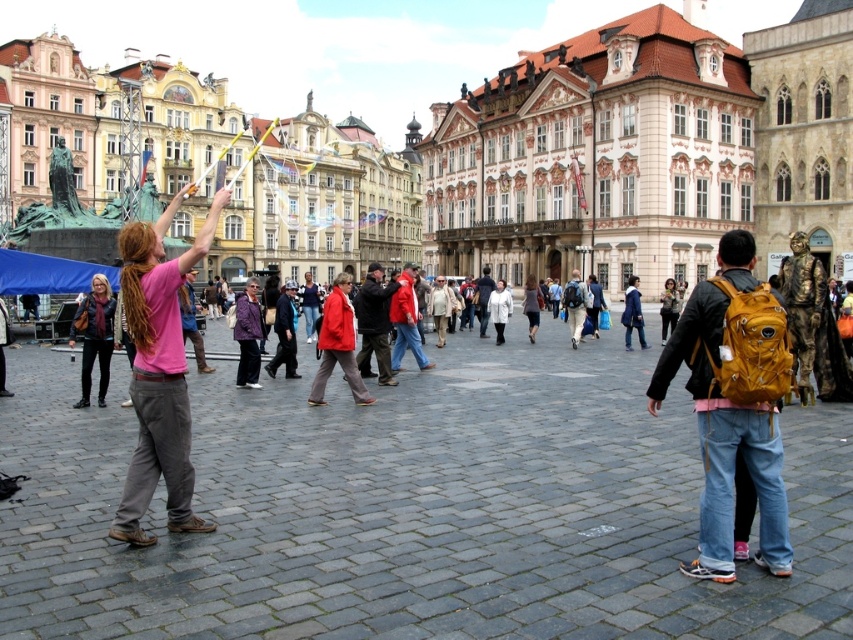
You are a traveler who just arrived in the town square and wants to find a place to store your large backpack. You notice the matte yellow backpack at right and the leather jacket at center. Which object is bigger and can accommodate your backpack?

The matte yellow backpack at right is larger in size compared to the leather jacket at center, so it can accommodate your backpack.